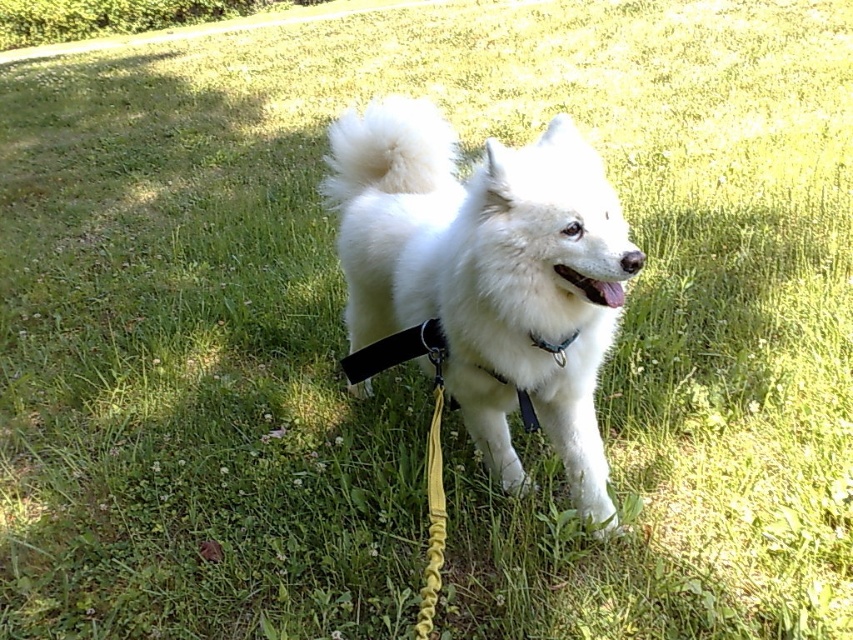
Does point (354, 384) come farther from viewer compared to point (537, 344)?

Yes.

Is black nylon strap at center below black plastic neckband at center?

Indeed, black nylon strap at center is positioned under black plastic neckband at center.

Locate an element on the screen. black nylon strap at center is located at coordinates (398, 353).

Does point (477, 378) come behind point (492, 376)?

Yes.

Between white fluffy dog at center and black nylon strap at center, which one is positioned higher?

white fluffy dog at center is higher up.

Locate an element on the screen. The width and height of the screenshot is (853, 640). white fluffy dog at center is located at coordinates (486, 273).

This screenshot has width=853, height=640. In order to click on white fluffy dog at center in this screenshot , I will do `click(486, 273)`.

Is white fluffy dog at center shorter than black plastic neckband at center?

Incorrect, white fluffy dog at center's height does not fall short of black plastic neckband at center's.

Who is more forward, [485,298] or [540,344]?

Point [485,298]

Locate an element on the screen. Image resolution: width=853 pixels, height=640 pixels. white fluffy dog at center is located at coordinates (486, 273).